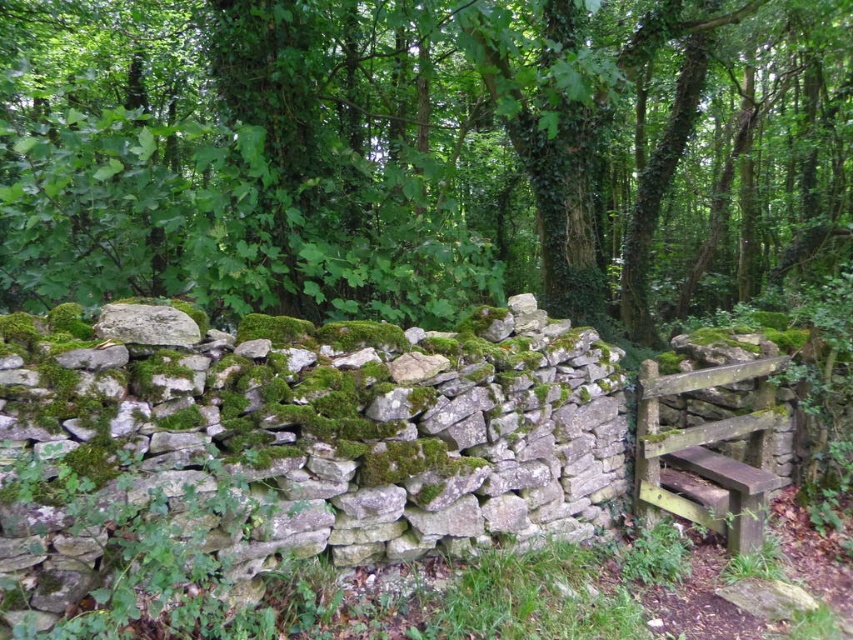
Question: Among these points, which one is farthest from the camera?

Choices:
 (A) pos(664,502)
 (B) pos(508,125)

Answer: (B)

Question: Can you confirm if green mossy rock at upper left is positioned to the left of gray stone wall at center?

Choices:
 (A) no
 (B) yes

Answer: (A)

Question: Is green mossy rock at upper left smaller than wooden gate at right?

Choices:
 (A) yes
 (B) no

Answer: (B)

Question: From the image, what is the correct spatial relationship of green mossy rock at upper left in relation to wooden gate at right?

Choices:
 (A) below
 (B) above

Answer: (B)

Question: Considering the real-world distances, which object is closest to the wooden gate at right?

Choices:
 (A) gray stone wall at center
 (B) green mossy rock at upper left

Answer: (A)

Question: Which point is farther from the camera taking this photo?

Choices:
 (A) (108, 378)
 (B) (422, 51)

Answer: (B)